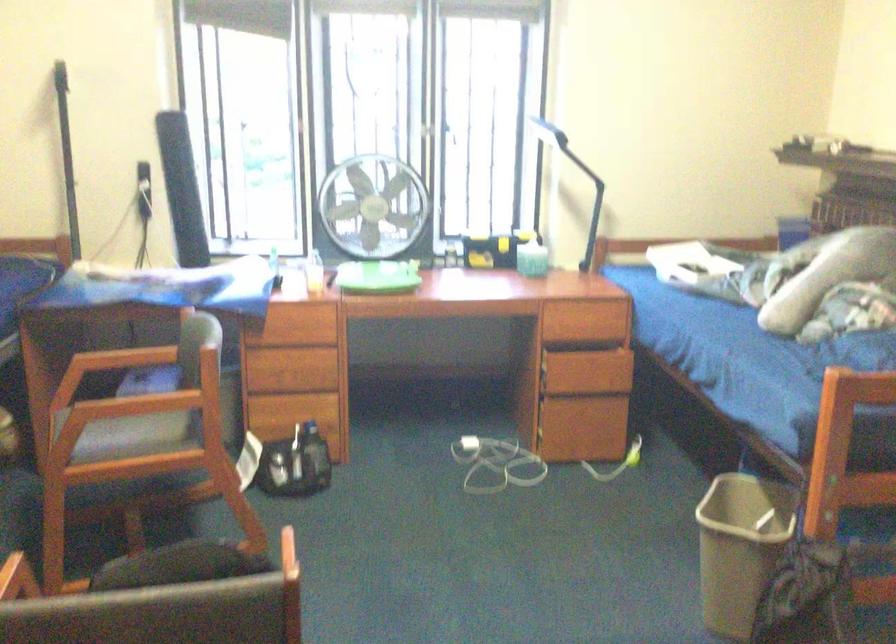
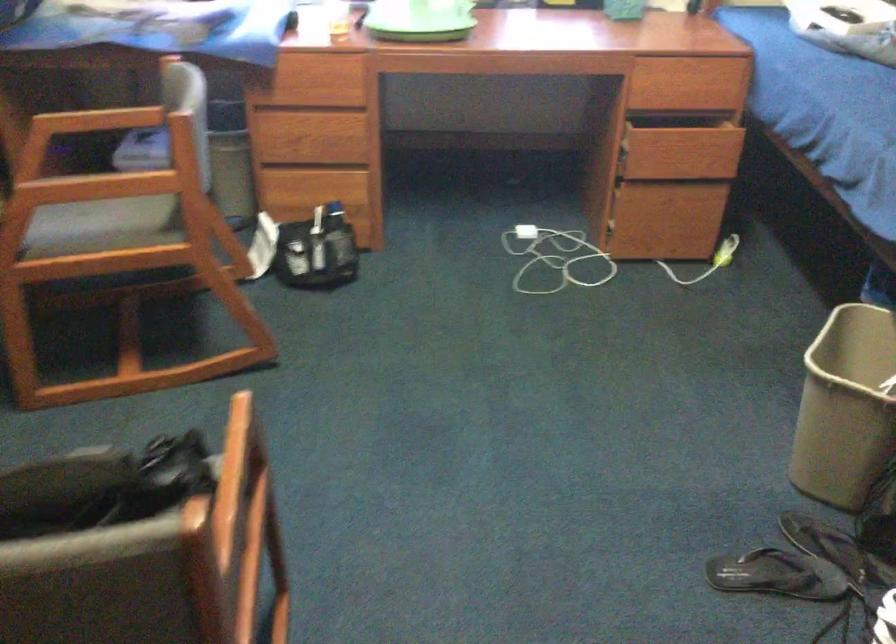
Question: Based on the continuous images, in which direction is the camera rotating? Reply with the corresponding letter.

Choices:
 (A) Left
 (B) Right
 (C) Up
 (D) Down

Answer: (D)